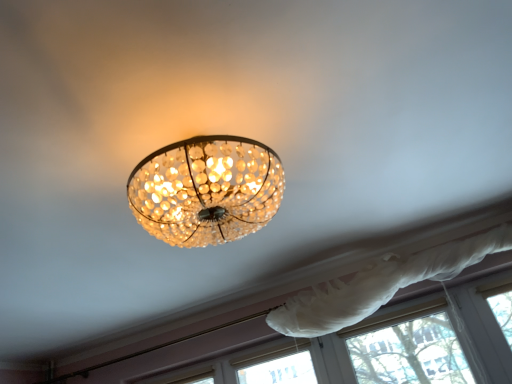
You are a GUI agent. You are given a task and a screenshot of the screen. Output one action in this format:
    pyautogui.click(x=<x>, y=<y>)
    Task: Click on the white sheer curtain at lower right
    The width and height of the screenshot is (512, 384).
    Given the screenshot: What is the action you would take?
    [x=384, y=346]

In order to face white sheer curtain at lower right, should I rotate leftwards or rightwards?

You should look right and rotate roughly 6.053 degrees.

What do you see at coordinates (384, 346) in the screenshot?
I see `white sheer curtain at lower right` at bounding box center [384, 346].

Describe the element at coordinates (380, 285) in the screenshot. The width and height of the screenshot is (512, 384). I see `white sheer curtain at upper center` at that location.

At what (x,y) coordinates should I click in order to perform the action: click on white sheer curtain at upper center. Please return your answer as a coordinate pair (x, y). Looking at the image, I should click on (380, 285).

Where is `white sheer curtain at lower right`? white sheer curtain at lower right is located at coordinates (384, 346).

Is white sheer curtain at lower right to the left of white sheer curtain at upper center from the viewer's perspective?

Yes.

Considering their positions, is white sheer curtain at lower right located in front of or behind white sheer curtain at upper center?

white sheer curtain at lower right is behind white sheer curtain at upper center.

Which point is more distant from viewer, [258,380] or [347,325]?

The point [258,380] is farther from the camera.

From the image's perspective, which object appears higher, white sheer curtain at lower right or white sheer curtain at upper center?

white sheer curtain at upper center appears higher in the image.

From a real-world perspective, is white sheer curtain at lower right located beneath white sheer curtain at upper center?

No.

Which object is thinner, white sheer curtain at lower right or white sheer curtain at upper center?

With smaller width is white sheer curtain at lower right.

Consider the image. Who is shorter, white sheer curtain at lower right or white sheer curtain at upper center?

white sheer curtain at lower right.

Considering the relative sizes of white sheer curtain at lower right and white sheer curtain at upper center in the image provided, is white sheer curtain at lower right smaller than white sheer curtain at upper center?

Indeed, white sheer curtain at lower right has a smaller size compared to white sheer curtain at upper center.

Which is correct: white sheer curtain at lower right is inside white sheer curtain at upper center, or outside of it?

white sheer curtain at lower right is not inside white sheer curtain at upper center, it's outside.

Is white sheer curtain at lower right positioned far away from white sheer curtain at upper center?

white sheer curtain at lower right is near white sheer curtain at upper center, not far away.

Could you tell me if white sheer curtain at lower right is facing white sheer curtain at upper center?

Yes.

You are a GUI agent. You are given a task and a screenshot of the screen. Output one action in this format:
    pyautogui.click(x=<x>, y=<y>)
    Task: Click on the curtain that is under the white sheer curtain at lower right (from a real-world perspective)
    The width and height of the screenshot is (512, 384).
    Given the screenshot: What is the action you would take?
    pyautogui.click(x=380, y=285)

Which is more to the right, white sheer curtain at upper center or white sheer curtain at lower right?

white sheer curtain at upper center is more to the right.

Considering the positions of objects white sheer curtain at upper center and white sheer curtain at lower right in the image provided, who is in front, white sheer curtain at upper center or white sheer curtain at lower right?

white sheer curtain at upper center is more forward.

Is point (331, 299) closer to camera compared to point (398, 340)?

Yes, it is in front of point (398, 340).

From the image's perspective, is white sheer curtain at upper center on white sheer curtain at lower right?

Yes, from the image's perspective, white sheer curtain at upper center is over white sheer curtain at lower right.

From a real-world perspective, who is located lower, white sheer curtain at upper center or white sheer curtain at lower right?

white sheer curtain at upper center, from a real-world perspective.

Considering the sizes of objects white sheer curtain at upper center and white sheer curtain at lower right in the image provided, who is wider, white sheer curtain at upper center or white sheer curtain at lower right?

Wider between the two is white sheer curtain at upper center.

Who is taller, white sheer curtain at upper center or white sheer curtain at lower right?

Standing taller between the two is white sheer curtain at upper center.

Between white sheer curtain at upper center and white sheer curtain at lower right, which one has smaller size?

white sheer curtain at lower right.

Is white sheer curtain at upper center inside or outside of white sheer curtain at lower right?

The correct answer is: outside.

Is white sheer curtain at upper center directly adjacent to white sheer curtain at lower right?

No, white sheer curtain at upper center is not next to white sheer curtain at lower right.

Does white sheer curtain at upper center turn towards white sheer curtain at lower right?

No.

How distant is white sheer curtain at upper center from white sheer curtain at lower right?

A distance of 14.21 inches exists between white sheer curtain at upper center and white sheer curtain at lower right.

Locate an element on the screen. The width and height of the screenshot is (512, 384). curtain that appears above the white sheer curtain at lower right (from the image's perspective) is located at coordinates (380, 285).

Where is `window positioned vertically above the white sheer curtain at upper center (from a real-world perspective)`? window positioned vertically above the white sheer curtain at upper center (from a real-world perspective) is located at coordinates (384, 346).

Where is `curtain that is in front of the white sheer curtain at lower right`? The height and width of the screenshot is (384, 512). curtain that is in front of the white sheer curtain at lower right is located at coordinates (380, 285).